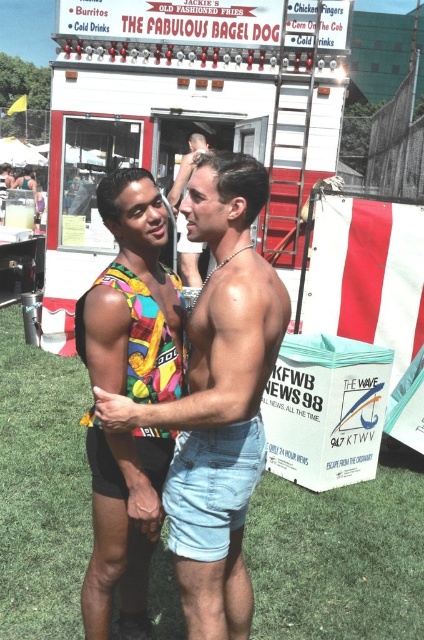
Is multicolored fabric top at center to the right of shiny silver chain at center from the viewer's perspective?

Correct, you'll find multicolored fabric top at center to the right of shiny silver chain at center.

Does multicolored fabric top at center have a greater height compared to shiny silver chain at center?

Yes, multicolored fabric top at center is taller than shiny silver chain at center.

Where is `multicolored fabric top at center`? This screenshot has height=640, width=424. multicolored fabric top at center is located at coordinates (133, 298).

Is point (147, 536) behind point (162, 387)?

That is False.

Is multicolored fabric top at center to the left of vibrant multicolored fabric bikini top at center from the viewer's perspective?

In fact, multicolored fabric top at center is to the right of vibrant multicolored fabric bikini top at center.

Between point (119, 316) and point (88, 291), which one is positioned behind?

The point (88, 291) is behind.

I want to click on multicolored fabric top at center, so click(x=133, y=298).

Between multicolored fabric top at center and denim shorts at center, which one appears on the right side from the viewer's perspective?

denim shorts at center

Does multicolored fabric top at center have a larger size compared to denim shorts at center?

Indeed, multicolored fabric top at center has a larger size compared to denim shorts at center.

At what (x,y) coordinates should I click in order to perform the action: click on multicolored fabric top at center. Please return your answer as a coordinate pair (x, y). The image size is (424, 640). Looking at the image, I should click on (133, 298).